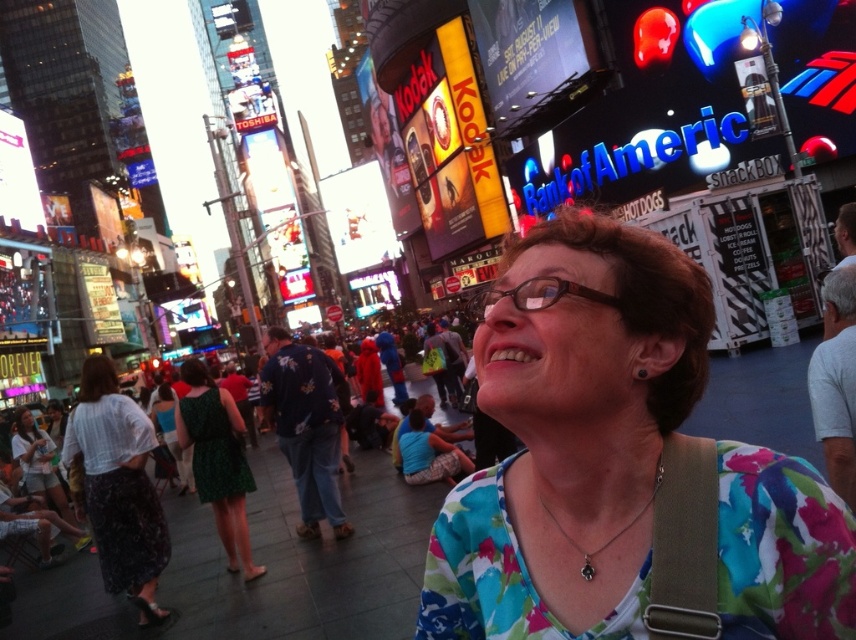
Question: Does floral fabric blouse at center appear under green textured dress at left?

Choices:
 (A) no
 (B) yes

Answer: (A)

Question: Is green dress at center positioned in front of green dotted dress at center?

Choices:
 (A) yes
 (B) no

Answer: (A)

Question: Among these objects, which one is farthest from the camera?

Choices:
 (A) matte white shirt at lower left
 (B) green dotted dress at center

Answer: (A)

Question: Which of the following is the farthest from the observer?

Choices:
 (A) (15, 456)
 (B) (156, 504)
 (C) (185, 442)

Answer: (A)

Question: Is the position of green textured dress at left less distant than that of matte white shirt at lower left?

Choices:
 (A) yes
 (B) no

Answer: (A)

Question: Which of the following is the farthest from the observer?

Choices:
 (A) (143, 467)
 (B) (634, 589)

Answer: (A)